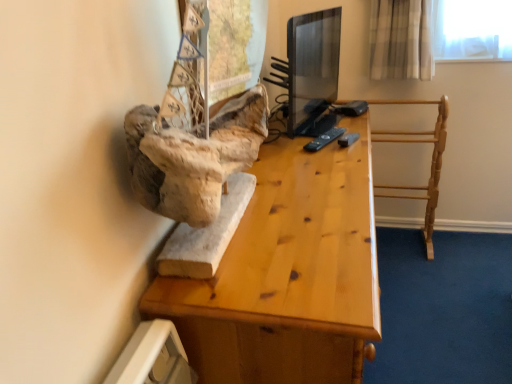
Question: Is light wood towel rack at right bigger than black plastic remote at center?

Choices:
 (A) yes
 (B) no

Answer: (A)

Question: Is light wood towel rack at right looking in the opposite direction of black plastic remote at center?

Choices:
 (A) yes
 (B) no

Answer: (B)

Question: Is light wood towel rack at right next to black plastic remote at center and touching it?

Choices:
 (A) no
 (B) yes

Answer: (A)

Question: From a real-world perspective, is light wood towel rack at right physically above black plastic remote at center?

Choices:
 (A) yes
 (B) no

Answer: (B)

Question: Would you say light wood towel rack at right is a long distance from black plastic remote at center?

Choices:
 (A) no
 (B) yes

Answer: (A)

Question: Is light wood towel rack at right aimed at black plastic remote at center?

Choices:
 (A) no
 (B) yes

Answer: (B)

Question: Is wooden desk at center next to black plastic remote at center and touching it?

Choices:
 (A) yes
 (B) no

Answer: (B)

Question: Is wooden desk at center aimed at black plastic remote at center?

Choices:
 (A) no
 (B) yes

Answer: (A)

Question: From a real-world perspective, does wooden desk at center sit lower than black plastic remote at center?

Choices:
 (A) yes
 (B) no

Answer: (A)

Question: From a real-world perspective, is wooden desk at center over black plastic remote at center?

Choices:
 (A) no
 (B) yes

Answer: (A)

Question: From the image's perspective, does wooden desk at center appear higher than black plastic remote at center?

Choices:
 (A) no
 (B) yes

Answer: (A)

Question: Is wooden desk at center closer to the viewer compared to black plastic remote at center?

Choices:
 (A) no
 (B) yes

Answer: (B)

Question: Is black plastic remote at center with wooden desk at center?

Choices:
 (A) no
 (B) yes

Answer: (A)